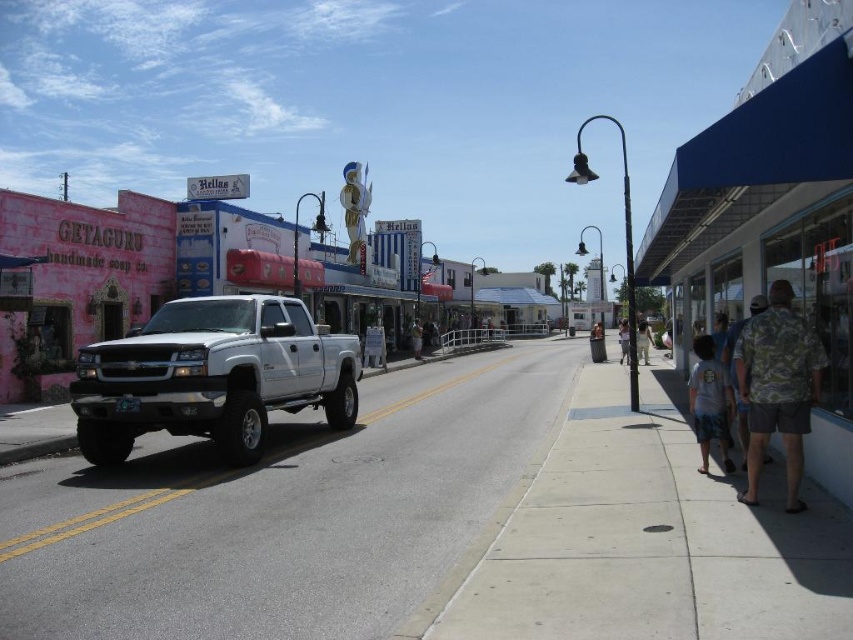
Consider the image. You are a photographer setting up a tripod to take a photo of the white metallic truck at center and the camouflage shirt at right. Since you want to ensure both subjects are in focus, you need to know which one is shorter. Can you tell me which is shorter?

The white metallic truck at center is not as tall as camouflage shirt at right, so the white metallic truck at center is shorter.

You are a customer looking to buy a shirt. You see two shirts displayed at the center of a store window. The camouflage shirt at center and the brown fabric shirt at center. Which shirt is taller?

The camouflage shirt at center is taller than the brown fabric shirt at center.

Looking at this image, you are standing on the sidewalk in front of the pink building with the handmade soap sign. You see two points marked on the ground ahead of you. The first point is at coordinates point (627, 336), and the second is at point (415, 352). Which point is closer to you?

Point (627, 336) is closer to the viewer than point (415, 352).